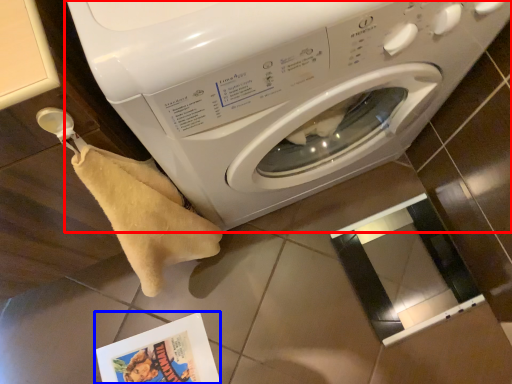
Question: Which object appears farthest to the camera in this image, washing machine (highlighted by a red box) or comic book (highlighted by a blue box)?

Choices:
 (A) washing machine
 (B) comic book

Answer: (B)